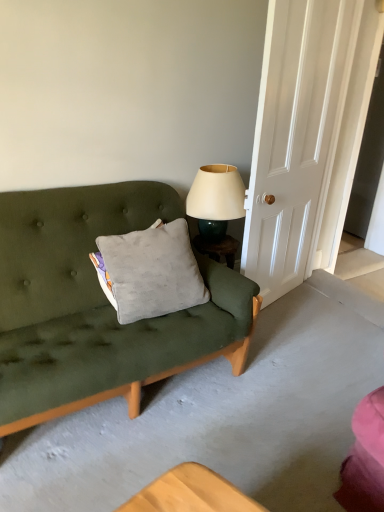
Question: Can you confirm if matte cream lampshade at upper right is positioned to the left of white wood door at right?

Choices:
 (A) no
 (B) yes

Answer: (B)

Question: Can you confirm if matte cream lampshade at upper right is wider than white wood door at right?

Choices:
 (A) yes
 (B) no

Answer: (A)

Question: From the image's perspective, is matte cream lampshade at upper right over white wood door at right?

Choices:
 (A) yes
 (B) no

Answer: (B)

Question: Is the depth of matte cream lampshade at upper right greater than that of white wood door at right?

Choices:
 (A) no
 (B) yes

Answer: (B)

Question: Can we say matte cream lampshade at upper right lies outside white wood door at right?

Choices:
 (A) no
 (B) yes

Answer: (B)

Question: Is matte cream lampshade at upper right placed right next to white wood door at right?

Choices:
 (A) no
 (B) yes

Answer: (A)

Question: Is gray velvety pillow at center turned away from white wood door at right?

Choices:
 (A) no
 (B) yes

Answer: (A)

Question: Is gray velvety pillow at center surrounding white wood door at right?

Choices:
 (A) no
 (B) yes

Answer: (A)

Question: Is the depth of gray velvety pillow at center less than that of white wood door at right?

Choices:
 (A) yes
 (B) no

Answer: (A)

Question: From a real-world perspective, is gray velvety pillow at center under white wood door at right?

Choices:
 (A) yes
 (B) no

Answer: (A)

Question: From a real-world perspective, is gray velvety pillow at center on top of white wood door at right?

Choices:
 (A) no
 (B) yes

Answer: (A)

Question: Are gray velvety pillow at center and white wood door at right located far from each other?

Choices:
 (A) yes
 (B) no

Answer: (B)

Question: Can you confirm if matte cream lampshade at upper right is positioned to the right of gray velvety pillow at center?

Choices:
 (A) yes
 (B) no

Answer: (A)